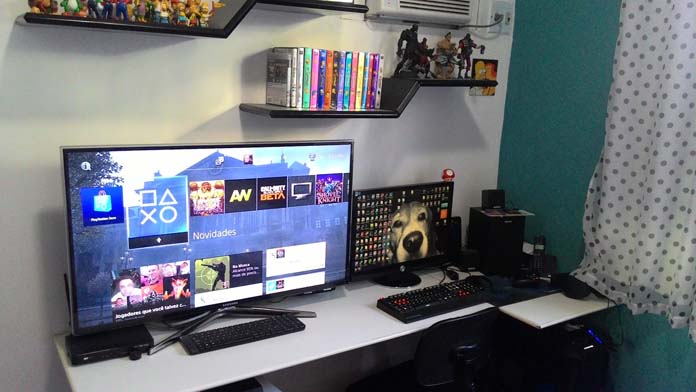
I want to click on mouse, so click(482, 279).